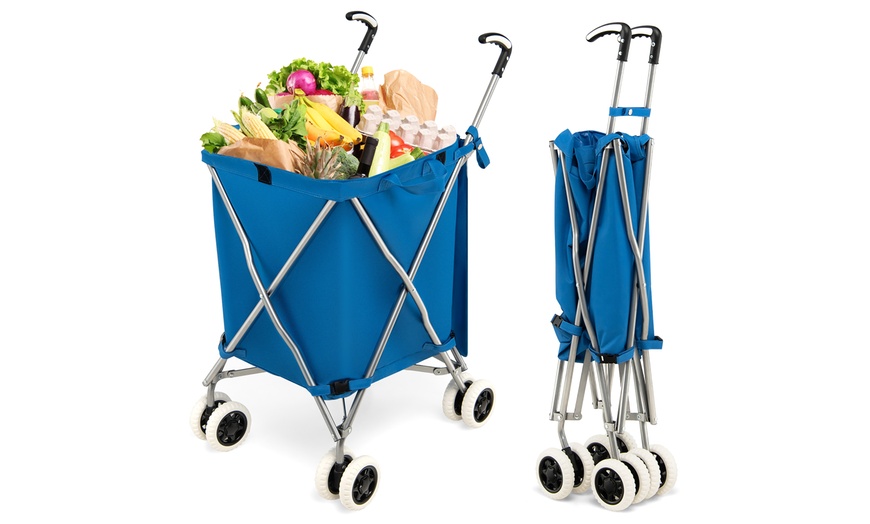
Identify the location of handle. The height and width of the screenshot is (524, 870). click(x=505, y=45), click(x=360, y=21), click(x=612, y=40), click(x=652, y=31).